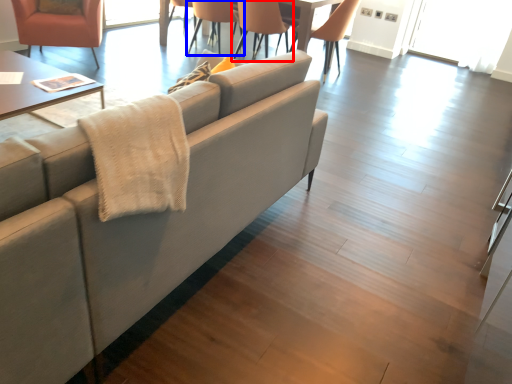
Question: Which point is further to the camera, chair (highlighted by a red box) or chair (highlighted by a blue box)?

Choices:
 (A) chair
 (B) chair

Answer: (B)